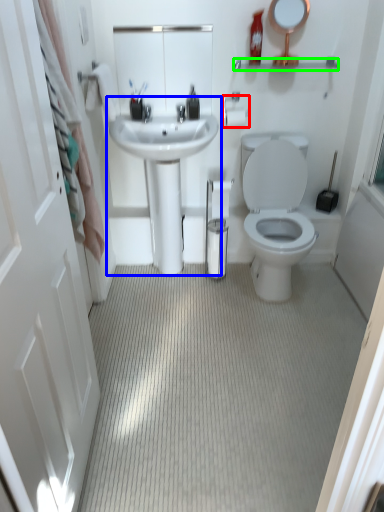
Question: Estimate the real-world distances between objects in this image. Which object is farther from towel bar (highlighted by a red box), sink (highlighted by a blue box) or balustrade (highlighted by a green box)?

Choices:
 (A) sink
 (B) balustrade

Answer: (A)